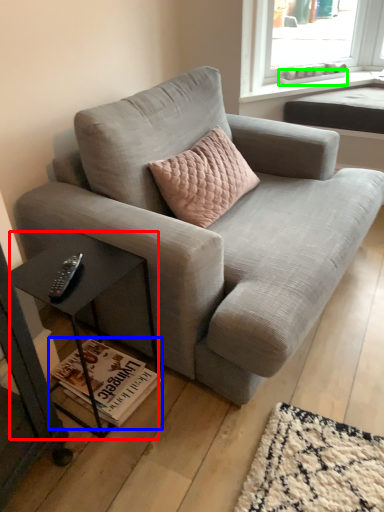
Question: Which is nearer to the table (highlighted by a red box)? magazine (highlighted by a blue box) or window sill (highlighted by a green box).

Choices:
 (A) magazine
 (B) window sill

Answer: (A)